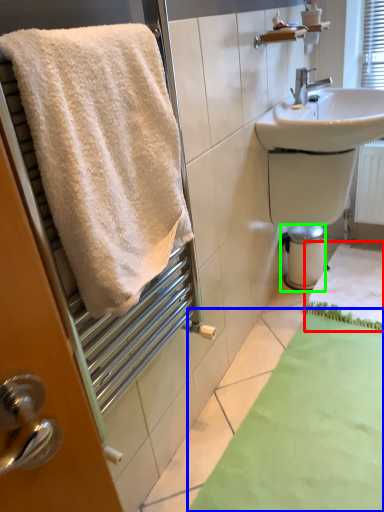
Question: Which is farther away from bath mat (highlighted by a red box)? bath mat (highlighted by a blue box) or bidet (highlighted by a green box)?

Choices:
 (A) bath mat
 (B) bidet

Answer: (A)